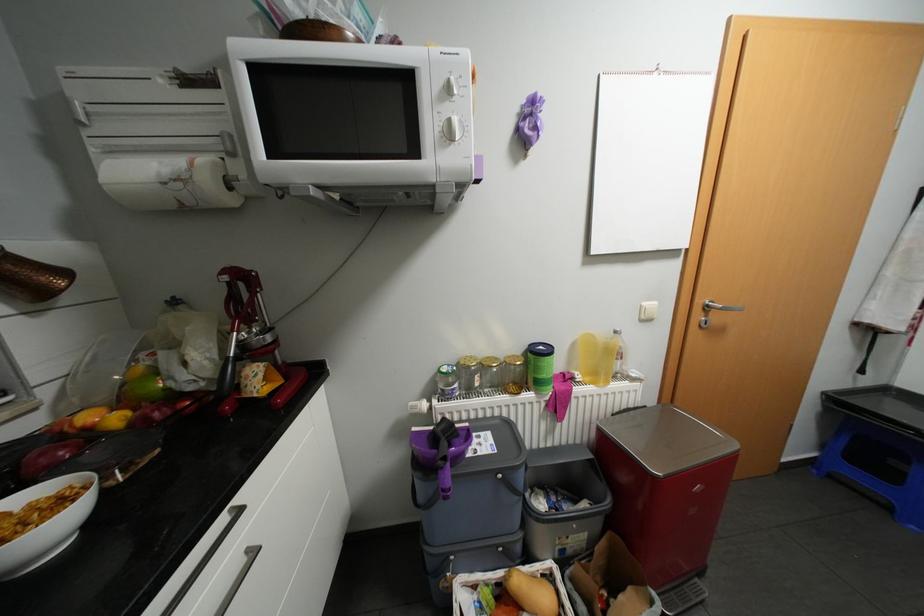
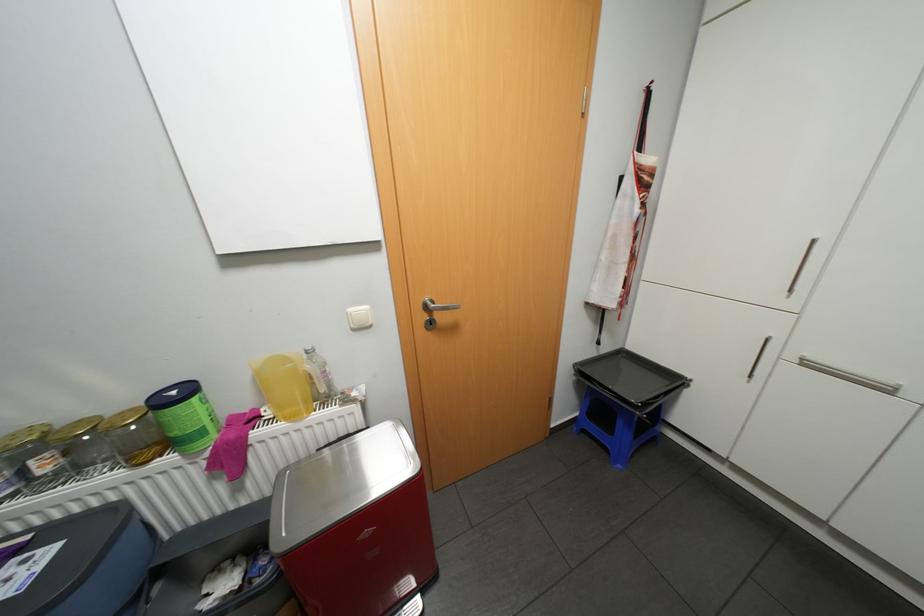
Locate, in the second image, the point that corresponds to [652,302] in the first image.

(358, 309)